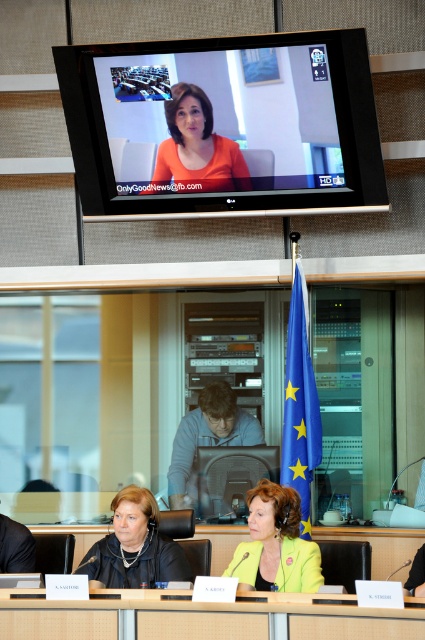
You are a technician adjusting the camera position to ensure all participants are visible. The camera is currently positioned 17.89 feet away from the yellow fabric jacket at lower center. Considering standard camera angles for video conferencing, is this distance appropriate for capturing a full view of the conference table and participants?

The camera is positioned 17.89 feet away from the yellow fabric jacket at lower center. This distance may be too far for a standard video conferencing setup, as most recommend placing the camera approximately 10 to 15 feet from the farthest participant to ensure everyone is in frame. Adjusting the camera closer would help capture a better view of the conference table and participants.